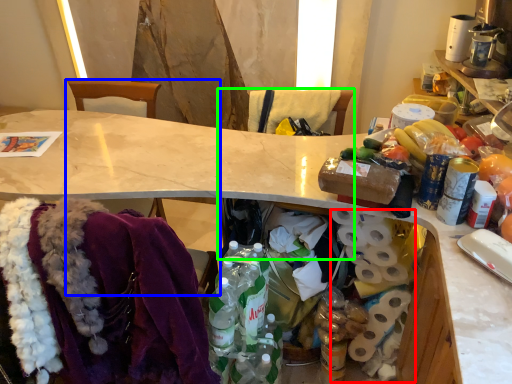
Question: Considering the real-world distances, which object is closest to toilet paper (highlighted by a red box)? chair (highlighted by a blue box) or chair (highlighted by a green box).

Choices:
 (A) chair
 (B) chair

Answer: (B)